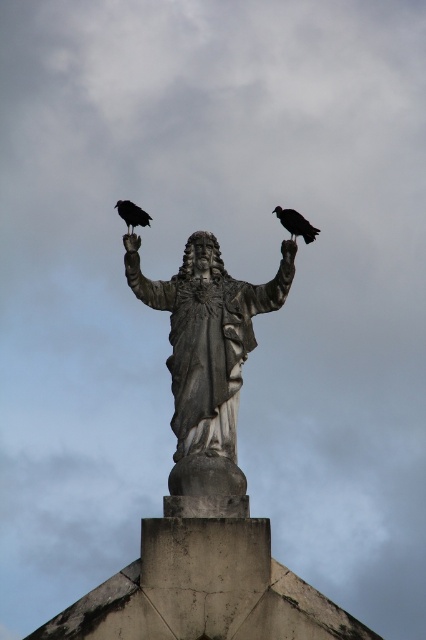
Question: Is black matte raven at upper right further to camera compared to black matte raven at upper left?

Choices:
 (A) no
 (B) yes

Answer: (A)

Question: Based on their relative distances, which object is farther from the black matte raven at upper left?

Choices:
 (A) black matte raven at upper right
 (B) gray stone statue at center

Answer: (B)

Question: Where is gray stone statue at center located in relation to black matte raven at upper right in the image?

Choices:
 (A) below
 (B) above

Answer: (A)

Question: Which of these objects is positioned farthest from the black matte raven at upper left?

Choices:
 (A) gray stone statue at center
 (B) black matte raven at upper right

Answer: (A)

Question: Does gray stone statue at center have a lesser width compared to black matte raven at upper right?

Choices:
 (A) yes
 (B) no

Answer: (B)

Question: Estimate the real-world distances between objects in this image. Which object is farther from the gray stone statue at center?

Choices:
 (A) black matte raven at upper right
 (B) black matte raven at upper left

Answer: (B)